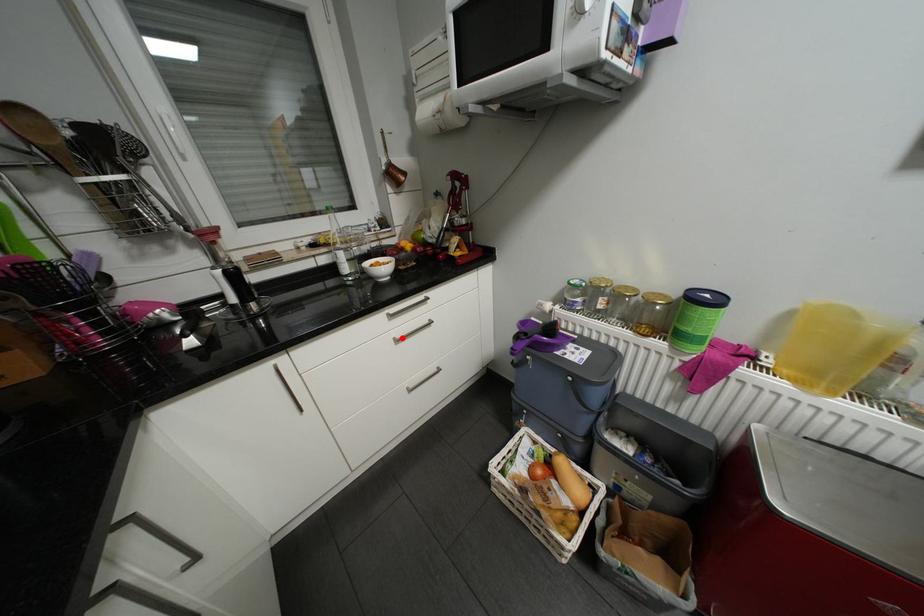
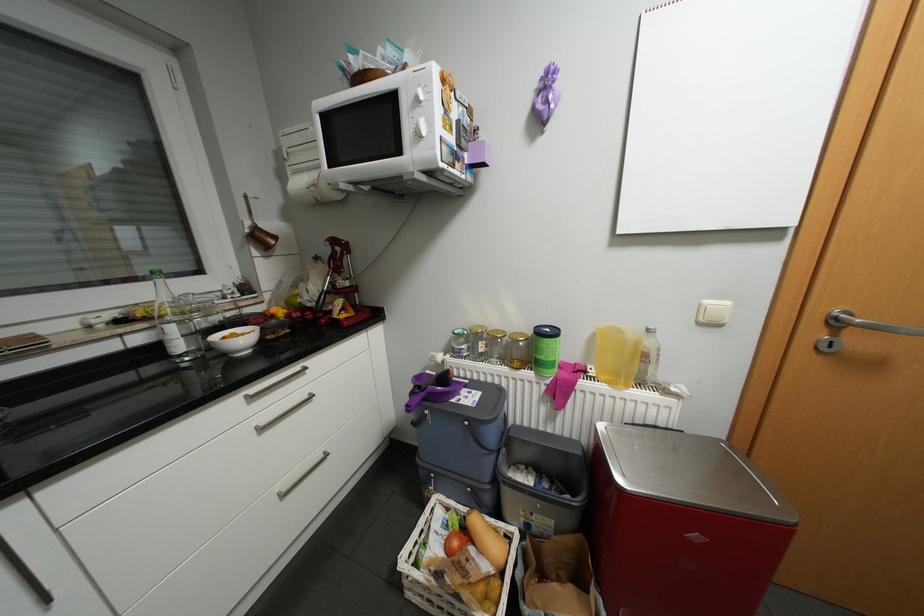
In the second image, find the point that corresponds to the highlighted location in the first image.

(264, 427)